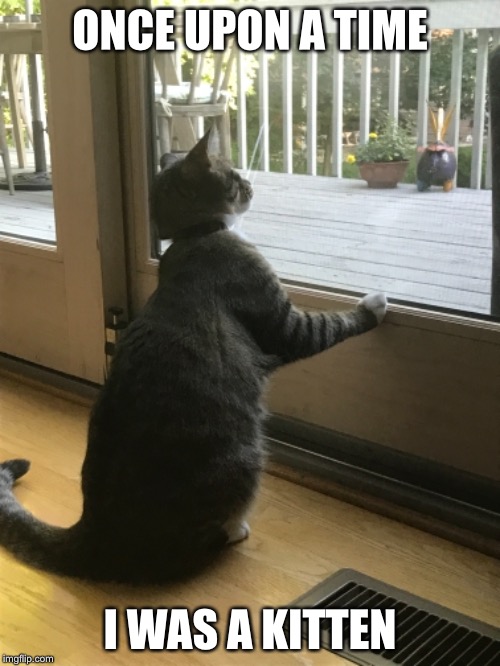
Locate an element on the screen. This screenshot has height=666, width=500. register is located at coordinates (440, 641).